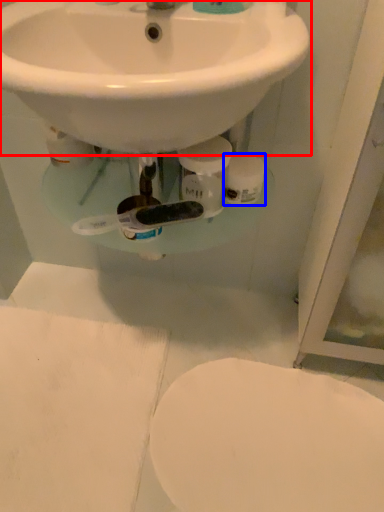
Question: Which object is further to the camera taking this photo, sink (highlighted by a red box) or toilet paper (highlighted by a blue box)?

Choices:
 (A) sink
 (B) toilet paper

Answer: (B)